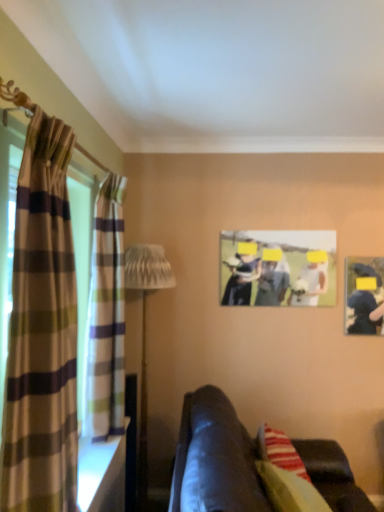
Question: Do you think plaid fabric curtain at left, positioned as the first curtain in back-to-front order, is within plaid fabric curtain at left, the second curtain viewed from the back, or outside of it?

Choices:
 (A) inside
 (B) outside

Answer: (B)

Question: From a real-world perspective, is plaid fabric curtain at left, positioned as the first curtain in back-to-front order, physically located above or below plaid fabric curtain at left, the second curtain viewed from the back?

Choices:
 (A) below
 (B) above

Answer: (B)

Question: Which object is positioned farthest from the plaid fabric curtain at left, the second curtain viewed from the back?

Choices:
 (A) plaid fabric curtain at left, which is counted as the 2th curtain, starting from the front
 (B) matte plastic picture frame at center
 (C) white textured lamp at left
 (D) velvet black couch at lower center

Answer: (B)

Question: Based on their relative distances, which object is nearer to the plaid fabric curtain at left, which is counted as the 2th curtain, starting from the front?

Choices:
 (A) matte plastic picture frame at center
 (B) white textured lamp at left
 (C) plaid fabric curtain at left, which appears as the 1th curtain when viewed from the front
 (D) velvet black couch at lower center

Answer: (C)